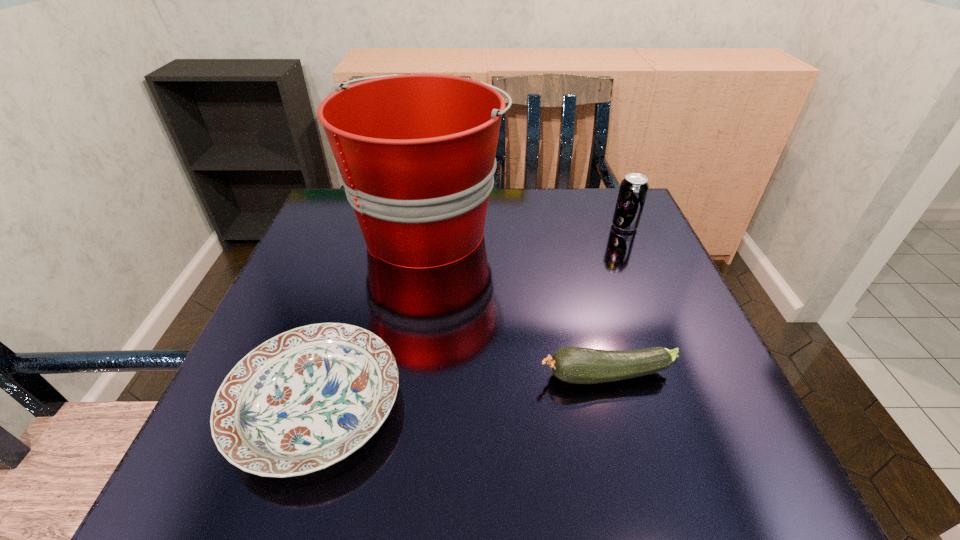
At what (x,y) coordinates should I click in order to perform the action: click on free point at the far edge. Please return your answer as a coordinate pair (x, y). This screenshot has width=960, height=540. Looking at the image, I should click on (514, 233).

I want to click on vacant position at the near edge of the desktop, so click(x=623, y=441).

Where is `blank space at the left edge of the desktop`? Image resolution: width=960 pixels, height=540 pixels. blank space at the left edge of the desktop is located at coordinates (302, 287).

Where is `free space at the right edge`? This screenshot has width=960, height=540. free space at the right edge is located at coordinates (x=681, y=391).

At what (x,y) coordinates should I click in order to perform the action: click on vacant space at the near left corner of the desktop. Please return your answer as a coordinate pair (x, y). The height and width of the screenshot is (540, 960). Looking at the image, I should click on (195, 465).

Find the location of a particular element. This screenshot has width=960, height=540. vacant space at the far right corner of the desktop is located at coordinates (609, 204).

The width and height of the screenshot is (960, 540). I want to click on free space at the near right corner, so click(x=716, y=489).

This screenshot has height=540, width=960. I want to click on free space between the second shortest object and the bucket, so click(x=517, y=303).

I want to click on vacant area that lies between the shortest object and the tallest object, so click(x=372, y=318).

Where is `free space between the bucket and the plate`? The image size is (960, 540). free space between the bucket and the plate is located at coordinates (372, 318).